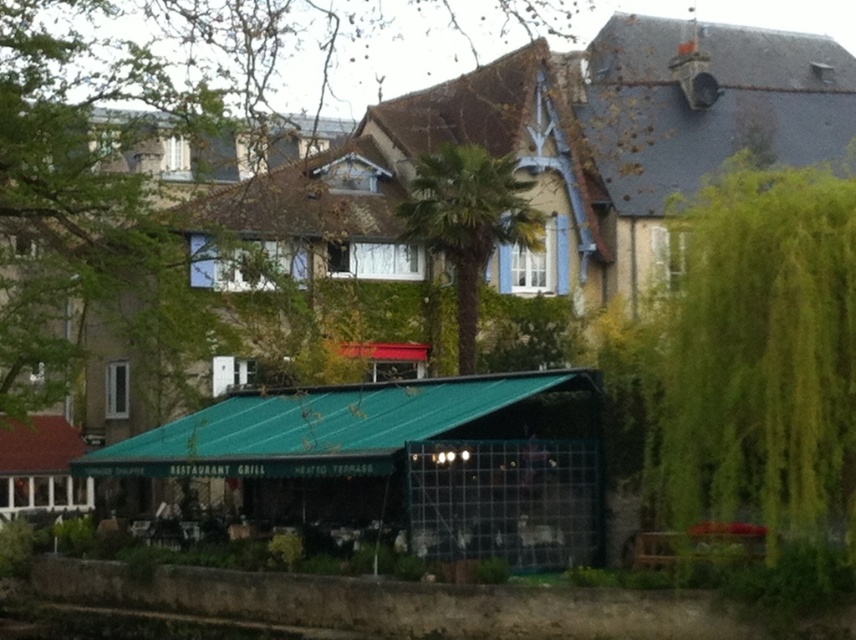
Who is higher up, green leafy tree at right or green metal awning at center?

green leafy tree at right is higher up.

Is green leafy tree at right behind green metal awning at center?

No, it is not.

The image size is (856, 640). In order to click on green leafy tree at right in this screenshot , I will do `click(762, 355)`.

Based on the photo, is green leafy tree at right above green leafy palm tree at center?

Actually, green leafy tree at right is below green leafy palm tree at center.

Image resolution: width=856 pixels, height=640 pixels. Find the location of `green leafy tree at right`. green leafy tree at right is located at coordinates (762, 355).

Which is behind, point (742, 173) or point (490, 177)?

The point (490, 177) is behind.

At what (x,y) coordinates should I click in order to perform the action: click on green leafy tree at right. Please return your answer as a coordinate pair (x, y). Looking at the image, I should click on (762, 355).

Does point (171, 476) come behind point (456, 317)?

No, (171, 476) is closer to viewer.

Which is more to the left, green metal awning at center or green leafy palm tree at center?

green metal awning at center

Identify the location of green metal awning at center. (405, 460).